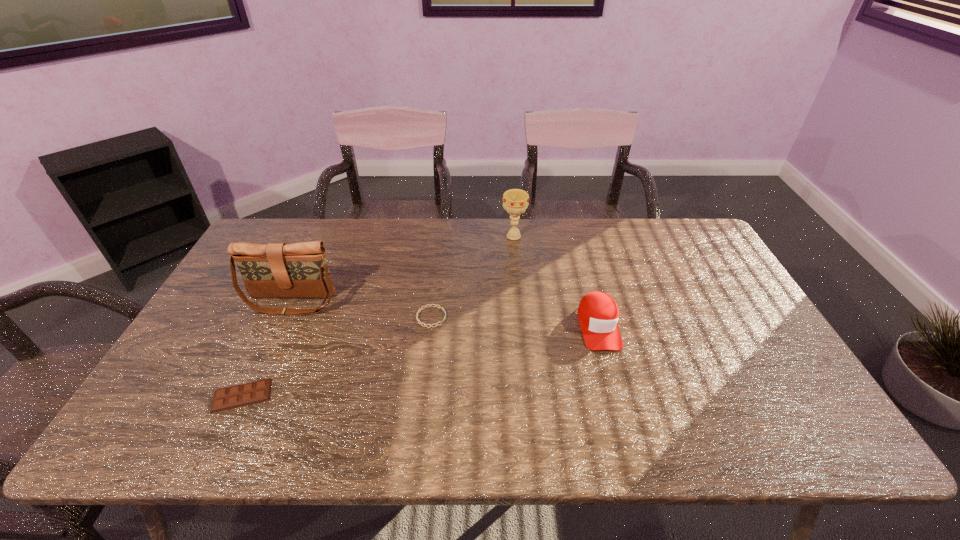
Locate an element on the screen. The width and height of the screenshot is (960, 540). shoulder bag is located at coordinates (276, 270).

Find the location of a particular element. The image size is (960, 540). the farthest object is located at coordinates (515, 201).

The width and height of the screenshot is (960, 540). I want to click on chalice, so click(515, 201).

Find the location of a particular element. The height and width of the screenshot is (540, 960). baseball cap is located at coordinates (598, 314).

The width and height of the screenshot is (960, 540). What are the coordinates of `the third tallest object` in the screenshot? It's located at (598, 314).

Identify the location of the nearest object. The image size is (960, 540). (236, 396).

Locate an element on the screen. bracelet is located at coordinates (420, 309).

Find the location of `free space located on the front-facing side of the shoulder bag`. free space located on the front-facing side of the shoulder bag is located at coordinates (227, 443).

Locate an element on the screen. free location located 0.140m on the front of the fourth shortest object is located at coordinates click(x=517, y=270).

This screenshot has height=540, width=960. Find the location of `vacant space situated 0.080m on the front-facing side of the rightmost object`. vacant space situated 0.080m on the front-facing side of the rightmost object is located at coordinates (612, 377).